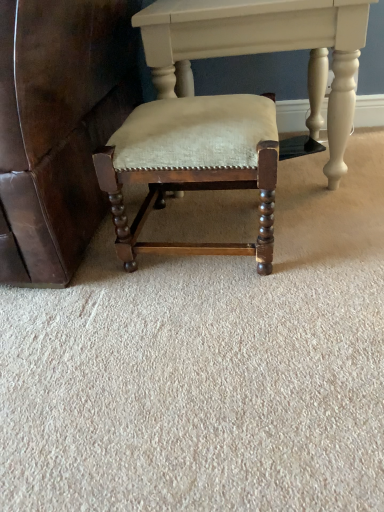
Question: Should I look upward or downward to see matte wood chair at center?

Choices:
 (A) up
 (B) down

Answer: (A)

Question: Is matte white table at center behind matte wood chair at center?

Choices:
 (A) no
 (B) yes

Answer: (B)

Question: Is matte white table at center thinner than matte wood chair at center?

Choices:
 (A) no
 (B) yes

Answer: (A)

Question: From a real-world perspective, is matte white table at center positioned over matte wood chair at center based on gravity?

Choices:
 (A) no
 (B) yes

Answer: (B)

Question: Would you consider matte white table at center to be distant from matte wood chair at center?

Choices:
 (A) yes
 (B) no

Answer: (B)

Question: Is matte white table at center not inside matte wood chair at center?

Choices:
 (A) yes
 (B) no

Answer: (A)

Question: Can you see matte white table at center touching matte wood chair at center?

Choices:
 (A) yes
 (B) no

Answer: (B)

Question: Can you confirm if matte wood chair at center is wider than matte white table at center?

Choices:
 (A) yes
 (B) no

Answer: (B)

Question: Is matte wood chair at center directly adjacent to matte white table at center?

Choices:
 (A) yes
 (B) no

Answer: (B)

Question: Would you say matte wood chair at center is a long distance from matte white table at center?

Choices:
 (A) yes
 (B) no

Answer: (B)

Question: Is matte wood chair at center oriented away from matte white table at center?

Choices:
 (A) yes
 (B) no

Answer: (A)

Question: From the image's perspective, is matte wood chair at center above matte white table at center?

Choices:
 (A) no
 (B) yes

Answer: (A)

Question: From a real-world perspective, is matte wood chair at center beneath matte white table at center?

Choices:
 (A) no
 (B) yes

Answer: (B)

Question: From a real-world perspective, is matte white table at center positioned above or below matte wood chair at center?

Choices:
 (A) above
 (B) below

Answer: (A)